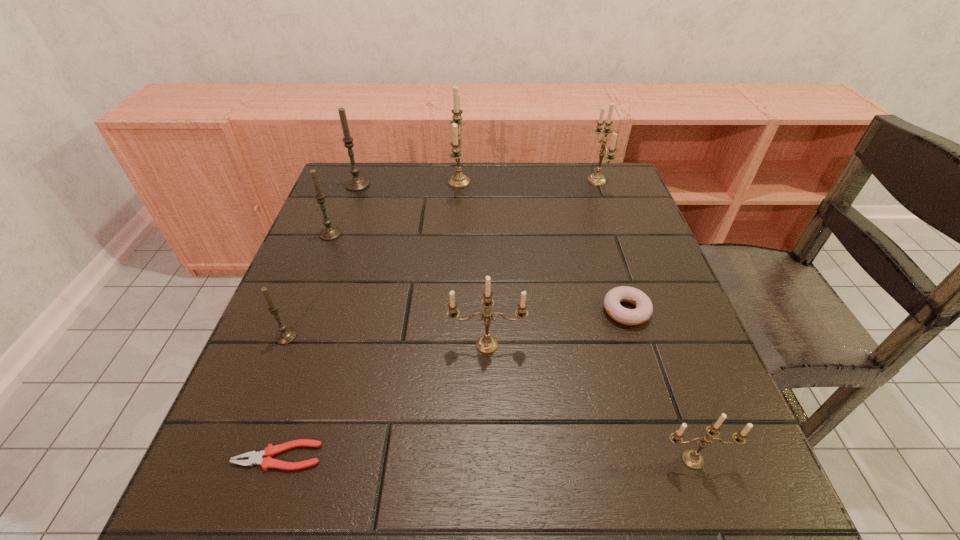
Identify the location of metallic candle that is the nearest to the nearest metallic candle. This screenshot has width=960, height=540. (486, 344).

You are a GUI agent. You are given a task and a screenshot of the screen. Output one action in this format:
    pyautogui.click(x=<x>, y=<y>)
    Task: Click on the metallic candle that is the third closest to the biggest metallic candle
    The height and width of the screenshot is (540, 960).
    Given the screenshot: What is the action you would take?
    pyautogui.click(x=691, y=458)

Locate which gray candle is the third closest to the brown doughnut. Please provide its 2D coordinates. Your answer should be formatted as a tuple, i.e. [(x, y)], where the tuple contains the x and y coordinates of a point satisfying the conditions above.

[(356, 183)]

Image resolution: width=960 pixels, height=540 pixels. Find the location of `gray candle that is the closest to the farthest gray candle`. gray candle that is the closest to the farthest gray candle is located at coordinates (329, 232).

Identify the location of blank space that satisfies the following two spatial constraints: 1. on the front side of the shortest object; 2. on the right side of the second nearest gray candle. (244, 456).

The height and width of the screenshot is (540, 960). I want to click on free region that satisfies the following two spatial constraints: 1. on the front side of the brown doughnut; 2. on the right side of the tallest candle, so tap(451, 311).